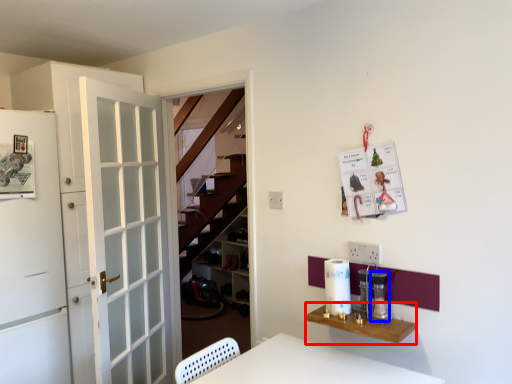
Question: Which object is closer to the camera taking this photo, table (highlighted by a red box) or appliance (highlighted by a blue box)?

Choices:
 (A) table
 (B) appliance

Answer: (A)